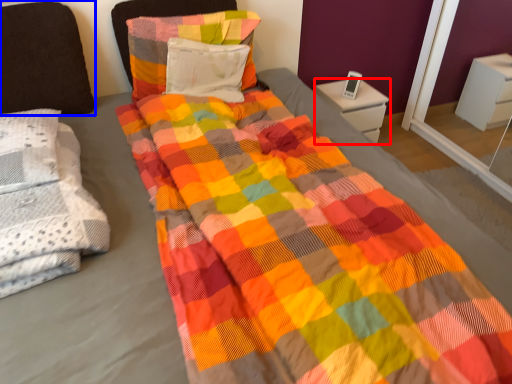
Question: Which of the following is the farthest to the observer, nightstand (highlighted by a red box) or pillow (highlighted by a blue box)?

Choices:
 (A) nightstand
 (B) pillow

Answer: (A)